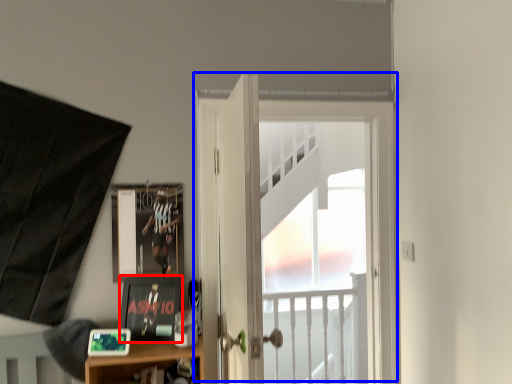
Question: Which object is further to the camera taking this photo, picture frame (highlighted by a red box) or door (highlighted by a blue box)?

Choices:
 (A) picture frame
 (B) door

Answer: (B)